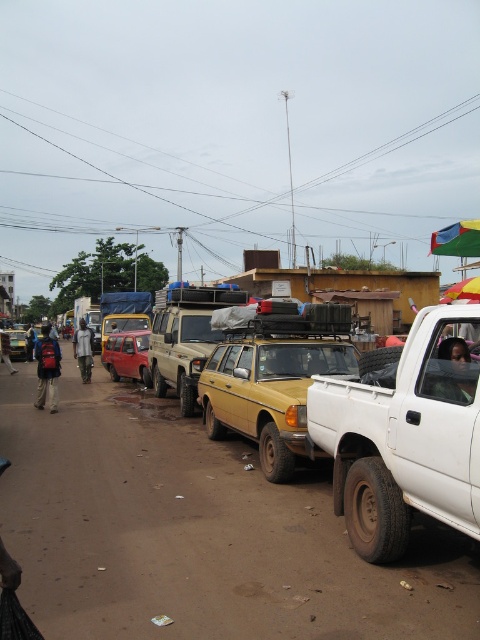
Based on the photo, you are a delivery person who needs to load a dark blue backpack at left onto the matte beige suv at center. Based on their sizes, will the backpack fit inside the SUV without any issues?

The matte beige suv at center is much taller than the dark blue backpack at left, so the backpack will fit inside the SUV without any issues.